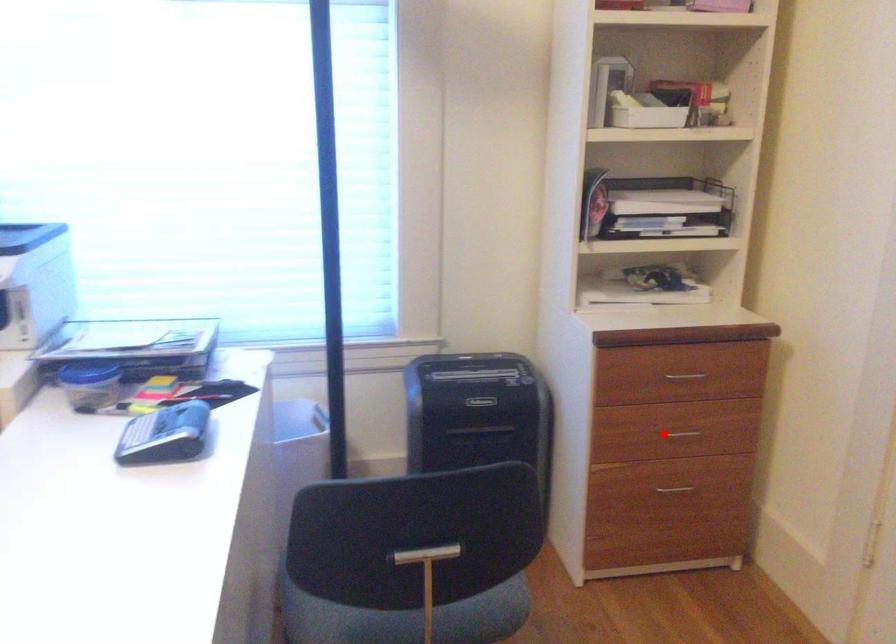
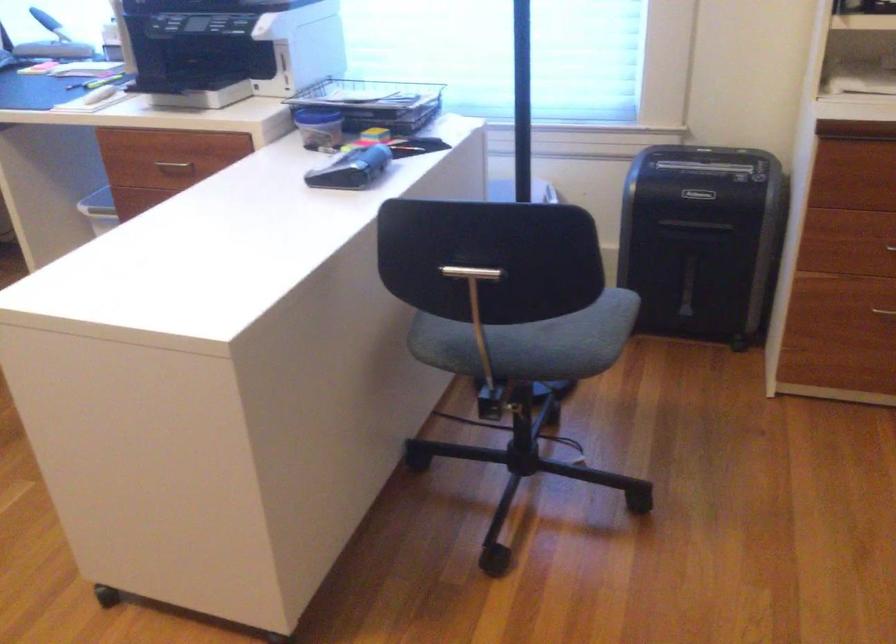
Question: A red point is marked in image1. In image2, is the corresponding 3D point closer to the camera or farther? Reply with the corresponding letter.

Choices:
 (A) The corresponding 3D point is closer.
 (B) The corresponding 3D point is farther.

Answer: (A)